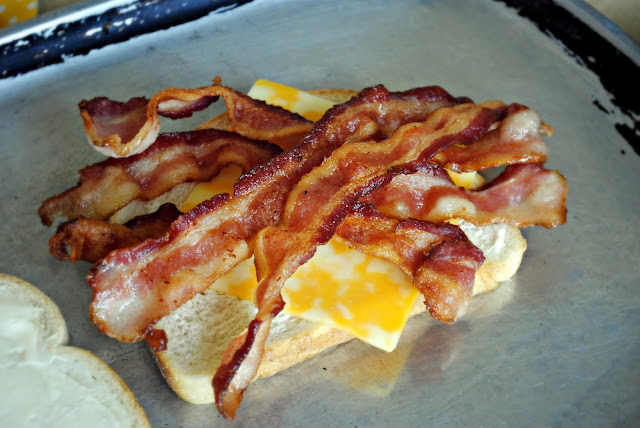
I want to click on table, so click(612, 14).